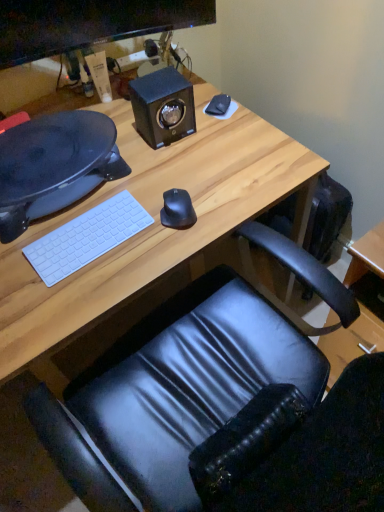
I want to click on free space in front of white matte keyboard at lower left, so pyautogui.click(x=75, y=295).